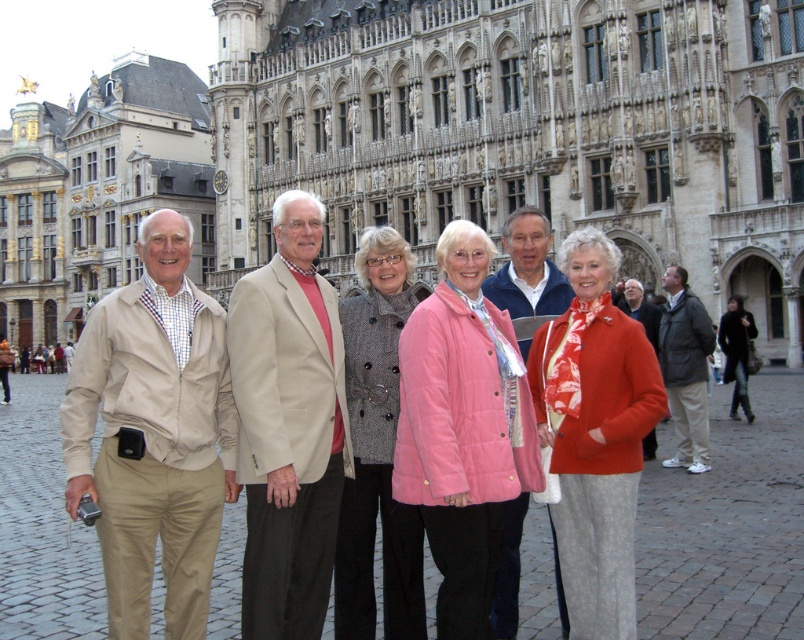
You are standing at the point marked by coordinates point (524,131). What is the object directly in front of you?

The stone carved building at center is directly in front of you at point (524,131).

You are a photographer trying to capture a clear shot of the blue quilted jacket at center and the orange quilted jacket at center. Since you want to focus on the blue one, which jacket should you adjust your camera to prioritize in focus?

The blue quilted jacket at center is in front of the orange quilted jacket at center, so to focus on the blue one, you should adjust your camera to prioritize the blue quilted jacket at center since it is closer to the camera.

You are a photographer trying to capture a group photo where the blue quilted jacket at center and orange quilted jacket at center are both visible. Based on their heights, which jacket should be positioned in the front row to ensure both are visible in the photo?

The orange quilted jacket at center should be positioned in the front row because it is shorter than the blue quilted jacket at center, allowing both to be visible without obstruction.